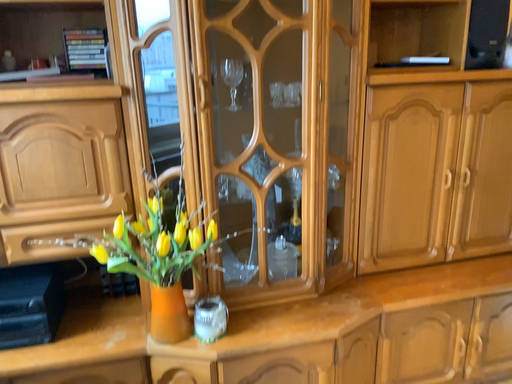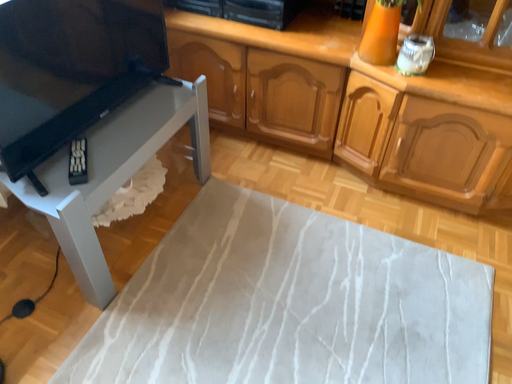
Question: How did the camera likely rotate when shooting the video?

Choices:
 (A) rotated downward
 (B) rotated upward

Answer: (A)